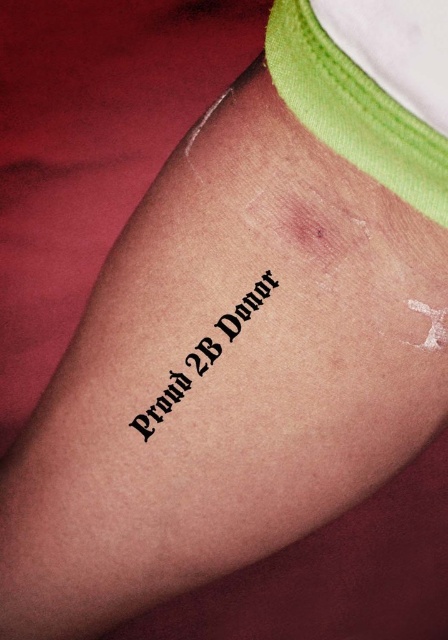
Based on the photo, does white fabric at upper right appear on the right side of black ink text at center?

Indeed, white fabric at upper right is positioned on the right side of black ink text at center.

Where is `white fabric at upper right`? white fabric at upper right is located at coordinates (354, 108).

Image resolution: width=448 pixels, height=640 pixels. I want to click on white fabric at upper right, so click(x=354, y=108).